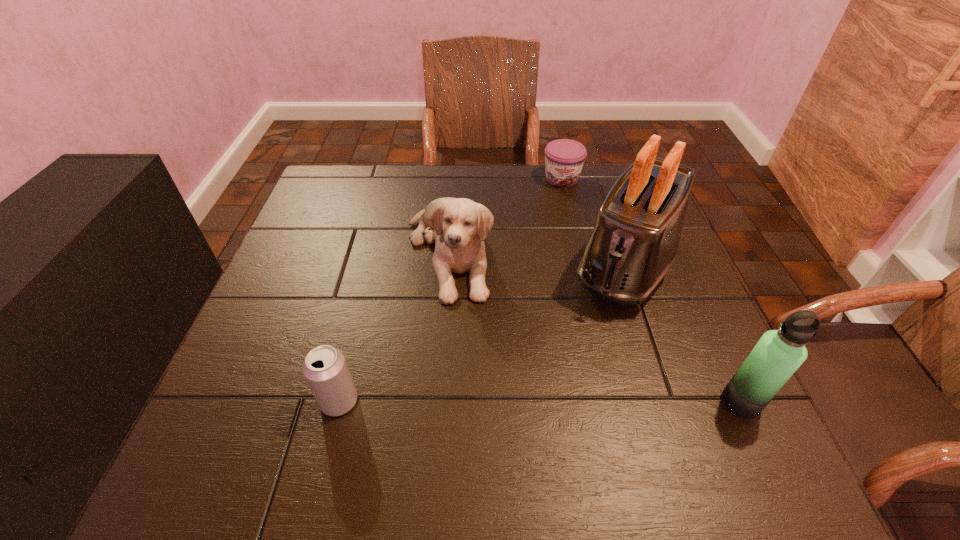
Locate an element on the screen. The height and width of the screenshot is (540, 960). puppy situated at the far edge is located at coordinates (460, 226).

This screenshot has height=540, width=960. I want to click on beer can present at the near edge, so click(x=325, y=369).

Locate an element on the screen. thermos bottle located in the near edge section of the desktop is located at coordinates (779, 353).

This screenshot has width=960, height=540. I want to click on thermos bottle at the right edge, so click(779, 353).

Where is `toaster that is positioned at the right edge`? toaster that is positioned at the right edge is located at coordinates (633, 245).

The image size is (960, 540). In order to click on object situated at the near right corner in this screenshot , I will do `click(779, 353)`.

Locate an element on the screen. vacant space at the far edge is located at coordinates (422, 185).

In the image, there is a desktop. Where is `vacant space at the near edge`? This screenshot has width=960, height=540. vacant space at the near edge is located at coordinates (602, 389).

Find the location of a particular element. vacant region at the left edge of the desktop is located at coordinates coord(348,231).

Locate an element on the screen. This screenshot has height=540, width=960. vacant region at the right edge of the desktop is located at coordinates (682, 278).